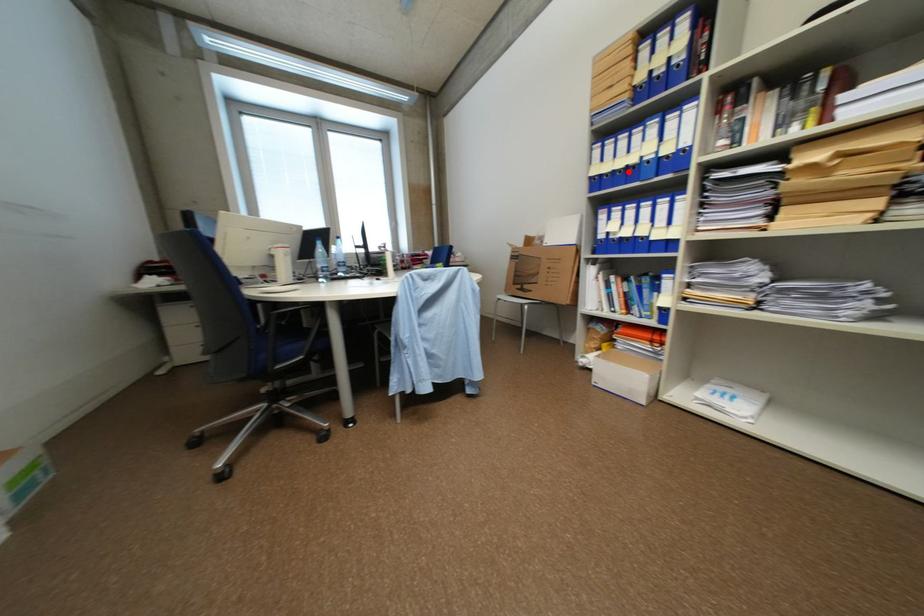
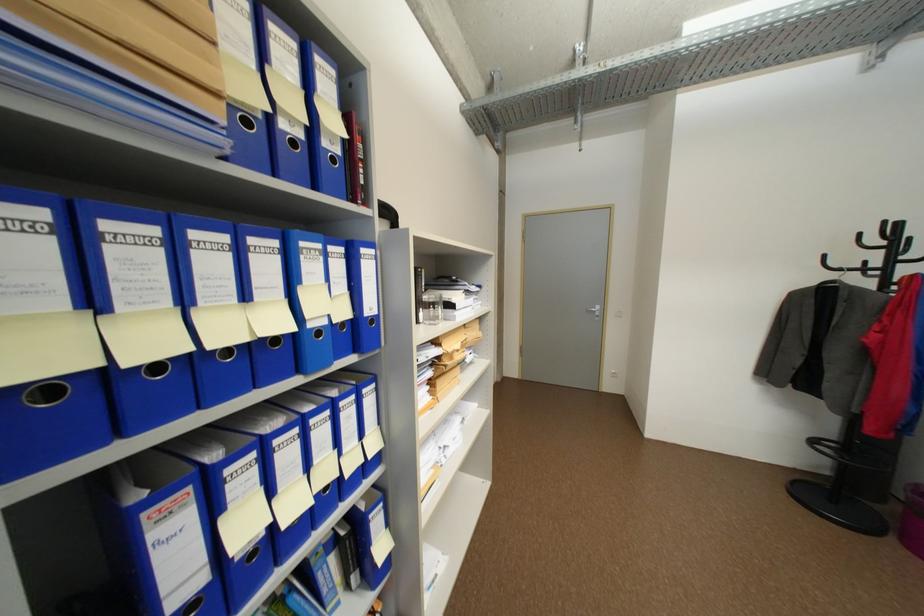
Question: I am providing you with two images of the same scene from different viewpoints. A red point is marked on the first image. Can you still see the location of the red point in image 2?

Choices:
 (A) Yes
 (B) No

Answer: (A)